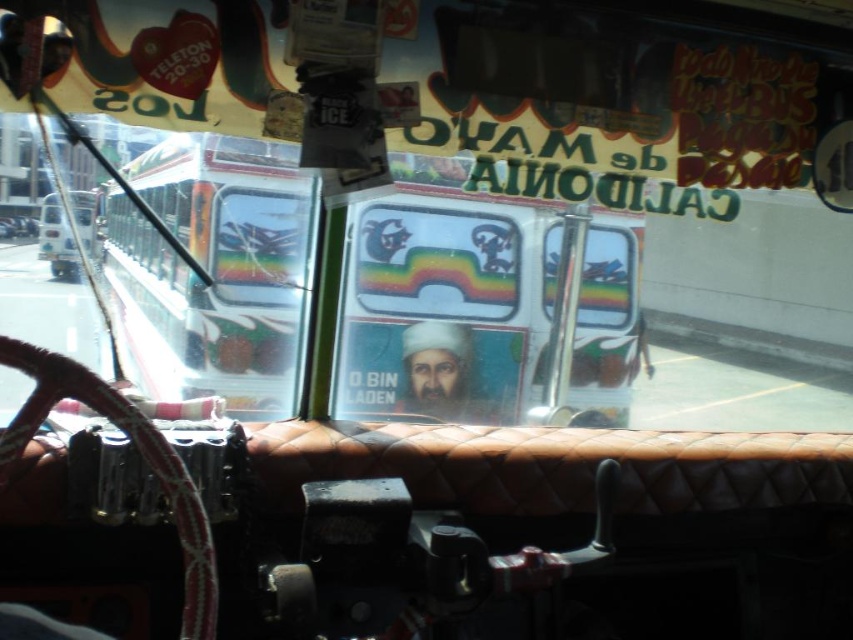
Does point (122, 220) come closer to viewer compared to point (74, 189)?

No, it is not.

Is metallic silver bus at left positioned behind white glossy bus at left?

No.

Identify the location of metallic silver bus at left. (215, 268).

Between metallic silver bus at left and metallic silver car at center, which one has more height?

With more height is metallic silver bus at left.

Does metallic silver bus at left appear under metallic silver car at center?

Yes.

Who is more distant from viewer, (253,365) or (16,232)?

The point (253,365) is behind.

Find the location of a particular element. metallic silver bus at left is located at coordinates (215, 268).

In the scene shown: Is matte plastic poster at center taller than metallic silver car at center?

Indeed, matte plastic poster at center has a greater height compared to metallic silver car at center.

Between point (409, 362) and point (22, 220), which one is positioned in front?

Point (22, 220) is in front.

Image resolution: width=853 pixels, height=640 pixels. What are the coordinates of `matte plastic poster at center` in the screenshot? It's located at (440, 372).